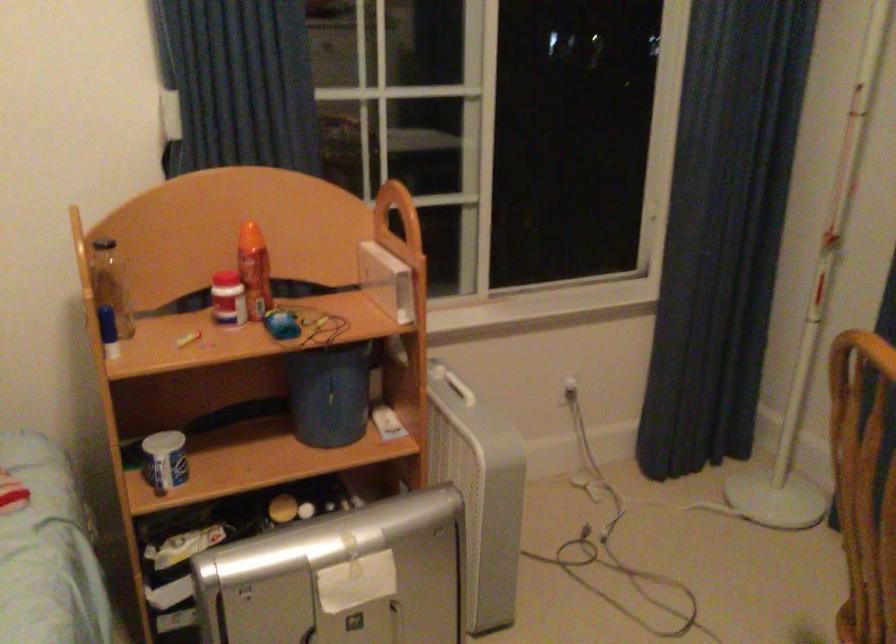
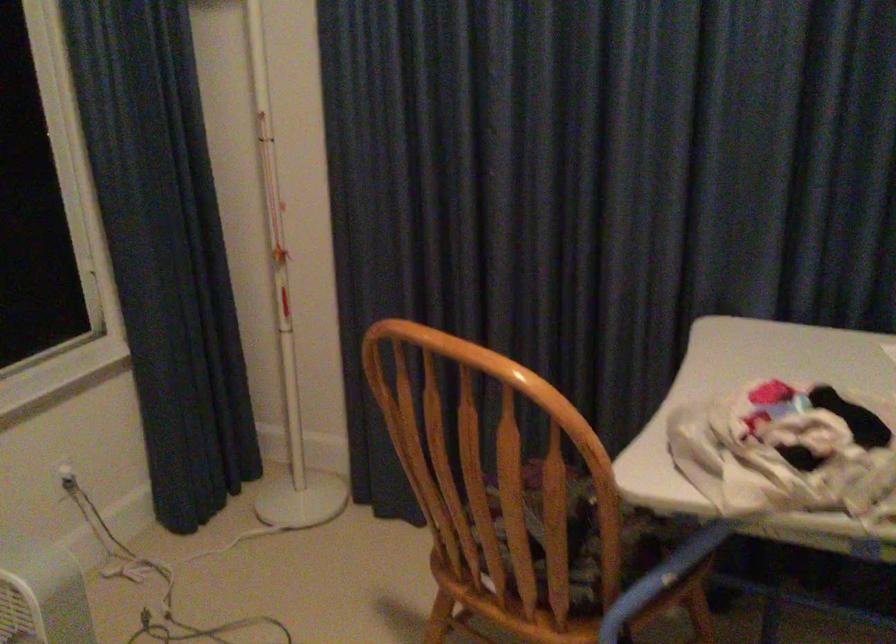
Find the pixel in the second image that matches (x=566, y=389) in the first image.

(65, 478)